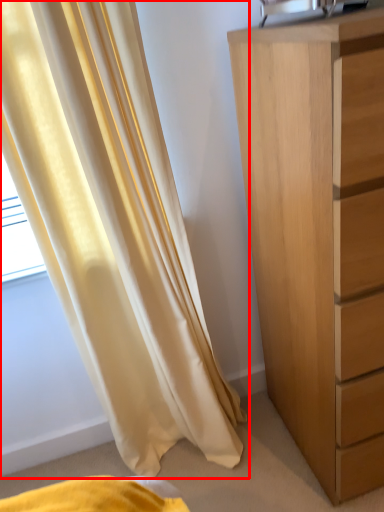
Question: In this image, where is curtain (annotated by the red box) located relative to chest of drawers?

Choices:
 (A) right
 (B) left

Answer: (B)